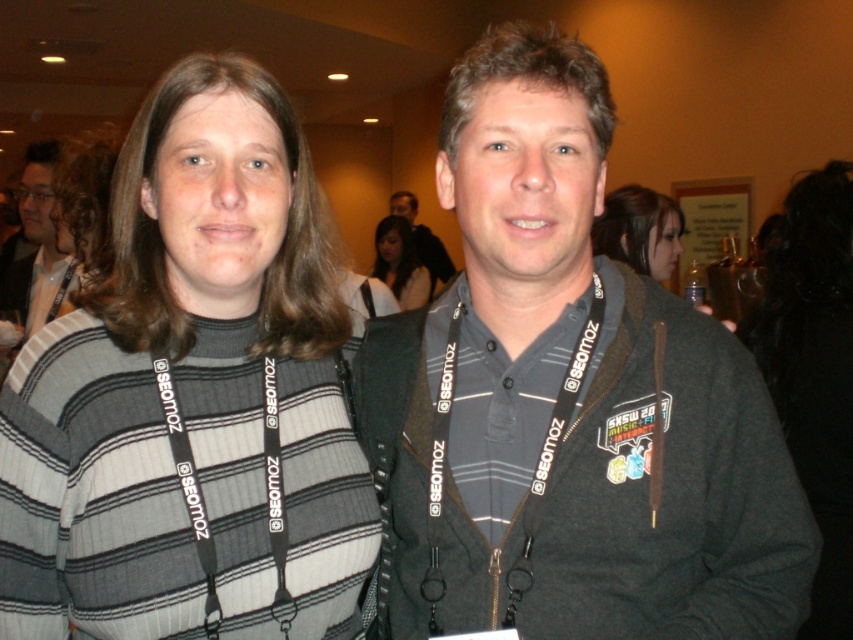
How far apart are matte black lanyard at center and matte black hair at center?

matte black lanyard at center and matte black hair at center are 2.47 meters apart.

Does matte black lanyard at center have a smaller size compared to matte black hair at center?

Indeed, matte black lanyard at center has a smaller size compared to matte black hair at center.

Is point (614, 257) farther from camera compared to point (398, 304)?

That is False.

Where is `matte black lanyard at center`? matte black lanyard at center is located at coordinates (640, 230).

Is striped sweater at center behind matte black lanyard at center?

No, striped sweater at center is in front of matte black lanyard at center.

You are a GUI agent. You are given a task and a screenshot of the screen. Output one action in this format:
    pyautogui.click(x=<x>, y=<y>)
    Task: Click on the striped sweater at center
    This screenshot has width=853, height=640.
    Given the screenshot: What is the action you would take?
    pyautogui.click(x=192, y=396)

Between point (656, 259) and point (427, 244), which one is positioned in front?

Point (656, 259) is more forward.

Measure the distance between matte black lanyard at center and gray fabric shirt at center.

The distance of matte black lanyard at center from gray fabric shirt at center is 10.13 feet.

Where is `matte black lanyard at center`? matte black lanyard at center is located at coordinates (640, 230).